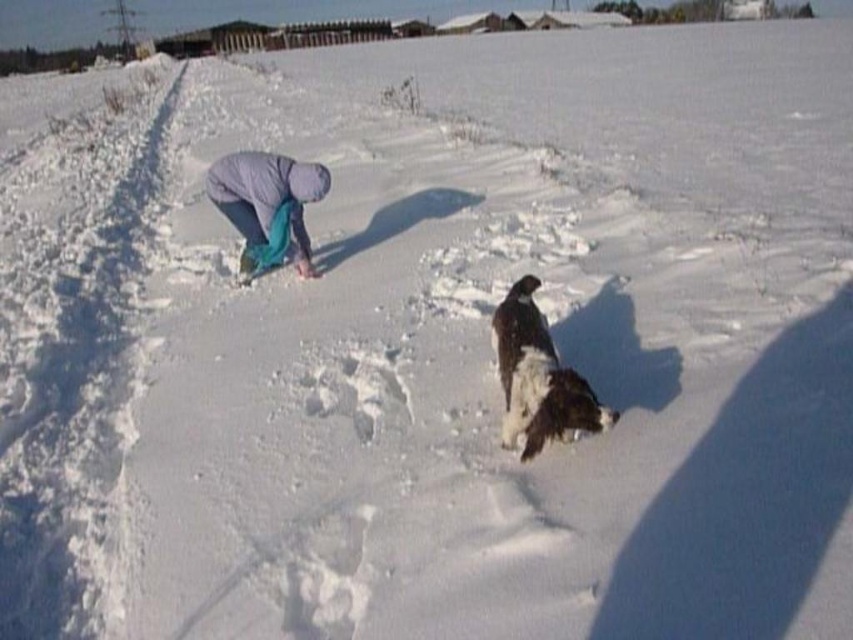
Question: Is white fluffy dog at center behind light purple fabric at center?

Choices:
 (A) yes
 (B) no

Answer: (B)

Question: Can you confirm if white fluffy dog at center is positioned above light purple fabric at center?

Choices:
 (A) yes
 (B) no

Answer: (B)

Question: Which of the following is the closest to the observer?

Choices:
 (A) light purple fabric at center
 (B) white fluffy dog at center

Answer: (B)

Question: Is white fluffy dog at center thinner than light purple fabric at center?

Choices:
 (A) yes
 (B) no

Answer: (A)

Question: Which point is farther to the camera?

Choices:
 (A) light purple fabric at center
 (B) white fluffy dog at center

Answer: (A)